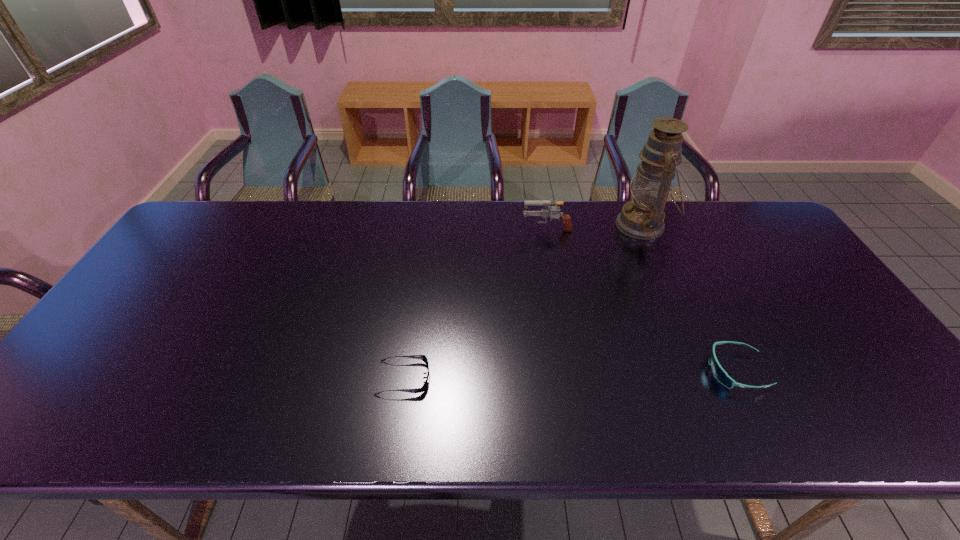
At what (x,y) coordinates should I click in order to perform the action: click on free space at the far left corner of the desktop. Please return your answer as a coordinate pair (x, y). Image resolution: width=960 pixels, height=540 pixels. Looking at the image, I should click on (230, 223).

Find the location of a particular element. The image size is (960, 540). vacant space at the far right corner is located at coordinates (716, 208).

Locate an element on the screen. This screenshot has height=540, width=960. vacant space at the near right corner of the desktop is located at coordinates (919, 422).

Find the location of a particular element. The width and height of the screenshot is (960, 540). free space between the second shortest object and the shortest object is located at coordinates (570, 374).

At what (x,y) coordinates should I click in order to perform the action: click on free area in between the third shortest object and the leftmost object. Please return your answer as a coordinate pair (x, y). Looking at the image, I should click on (475, 303).

In order to click on vacant space in between the tallest object and the second object from left to right in this screenshot , I will do `click(594, 226)`.

Locate an element on the screen. The height and width of the screenshot is (540, 960). blank region between the shortest object and the second tallest object is located at coordinates (475, 303).

You are a GUI agent. You are given a task and a screenshot of the screen. Output one action in this format:
    pyautogui.click(x=<x>, y=<y>)
    Task: Click on the free space between the second tallest object and the right sunglasses
    The image size is (960, 540).
    Given the screenshot: What is the action you would take?
    pyautogui.click(x=641, y=299)

Where is `vacant area between the shortest object and the oil lamp`? This screenshot has height=540, width=960. vacant area between the shortest object and the oil lamp is located at coordinates (523, 301).

The width and height of the screenshot is (960, 540). In order to click on vacant area between the second object from left to right and the right sunglasses in this screenshot , I will do `click(641, 299)`.